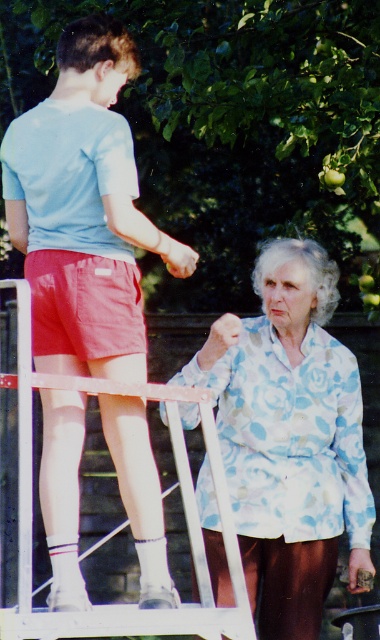
Question: Which of the following is the closest to the observer?

Choices:
 (A) (354, 413)
 (B) (50, 259)

Answer: (B)

Question: Which of the following is the closest to the observer?

Choices:
 (A) (50, 339)
 (B) (307, 324)
 (C) (134, 472)

Answer: (C)

Question: Can you confirm if floral-patterned shirt at lower right is smaller than matte red shorts at left?

Choices:
 (A) yes
 (B) no

Answer: (B)

Question: Is matte blue t-shirt at upper left closer to camera compared to matte red shorts at left?

Choices:
 (A) no
 (B) yes

Answer: (B)

Question: Among these objects, which one is nearest to the camera?

Choices:
 (A) floral-patterned shirt at lower right
 (B) matte blue t-shirt at upper left
 (C) matte red shorts at left

Answer: (B)

Question: Is floral-patterned shirt at lower right positioned behind matte red shorts at left?

Choices:
 (A) no
 (B) yes

Answer: (B)